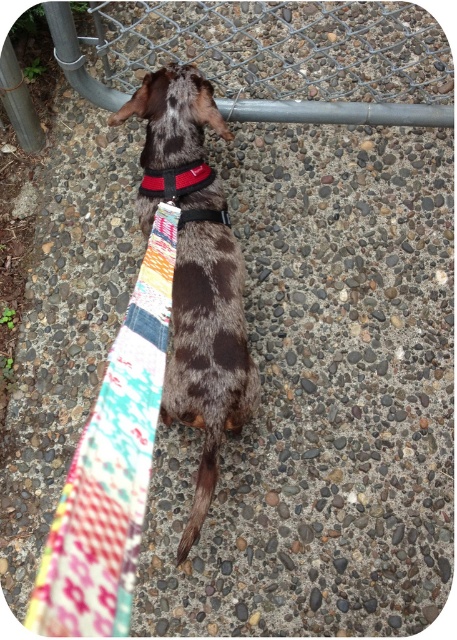
Question: Among these points, which one is nearest to the camera?

Choices:
 (A) (91, 516)
 (B) (187, 189)

Answer: (A)

Question: Which object is the closest to the brushed metal pole at upper left?

Choices:
 (A) spotted fur dog at center
 (B) patchwork fabric tie at lower left
 (C) red fabric neckband at center
 (D) black fabric strap at center

Answer: (C)

Question: Does red fabric neckband at center appear on the left side of black fabric strap at center?

Choices:
 (A) no
 (B) yes

Answer: (B)

Question: Does spotted fur dog at center lie behind patchwork fabric tie at lower left?

Choices:
 (A) yes
 (B) no

Answer: (A)

Question: Which point is closer to the camera taking this photo?

Choices:
 (A) (149, 449)
 (B) (153, 148)

Answer: (A)

Question: Is spotted fur dog at center to the left of black fabric strap at center from the viewer's perspective?

Choices:
 (A) no
 (B) yes

Answer: (B)